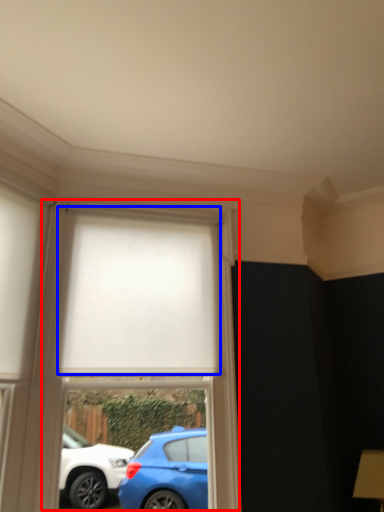
Question: Which of the following is the closest to the observer, bay window (highlighted by a red box) or curtain (highlighted by a blue box)?

Choices:
 (A) bay window
 (B) curtain

Answer: (A)